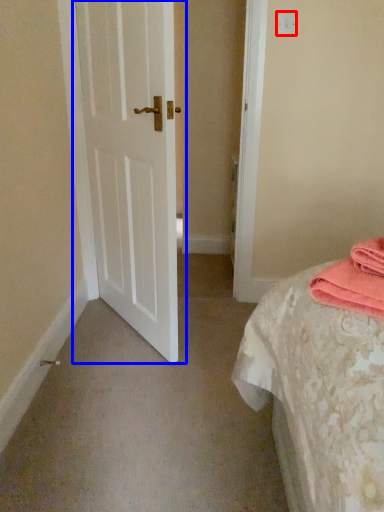
Question: Among these objects, which one is farthest to the camera, light switch (highlighted by a red box) or door (highlighted by a blue box)?

Choices:
 (A) light switch
 (B) door

Answer: (A)